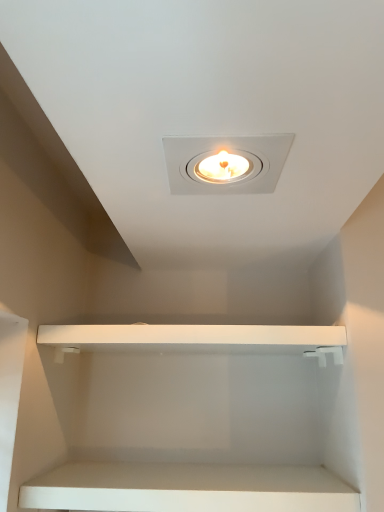
You are a GUI agent. You are given a task and a screenshot of the screen. Output one action in this format:
    pyautogui.click(x=<x>, y=<y>)
    Task: Click on the free point above white matte cabinet at lower center, which appears as the 2th cabinet when viewed from the top (from a real-world perspective)
    The width and height of the screenshot is (384, 512).
    Given the screenshot: What is the action you would take?
    pyautogui.click(x=199, y=478)